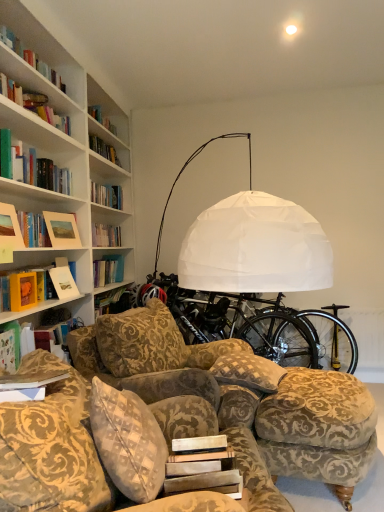
Locate an element on the screen. The image size is (384, 512). hardcover book at left, which ranks as the first book in top-to-bottom order is located at coordinates (63, 282).

What do you see at coordinates (150, 294) in the screenshot? I see `black matte bicycle wheel at center` at bounding box center [150, 294].

I want to click on matte green book at left, arranged as the 2th book when viewed from the top, so click(43, 340).

Is point (267, 366) closer or farther from the camera than point (18, 295)?

Point (267, 366) is positioned farther from the camera compared to point (18, 295).

Is patterned fabric pillow at center smaller than matte yellow book at left, acting as the first paperback book starting from the top?

Incorrect, patterned fabric pillow at center is not smaller in size than matte yellow book at left, acting as the first paperback book starting from the top.

From the image's perspective, is patterned fabric pillow at center on matte yellow book at left, the first paperback book when ordered from left to right?

Actually, patterned fabric pillow at center appears below matte yellow book at left, the first paperback book when ordered from left to right, in the image.

Is patterned fabric pillow at center touching matte yellow book at left, the second paperback book when ordered from bottom to top?

No.

Would you say patterned fabric pillow at center is a long distance from velvet-patterned couch at lower center?

Absolutely, patterned fabric pillow at center is distant from velvet-patterned couch at lower center.

Is patterned fabric pillow at center bigger or smaller than velvet-patterned couch at lower center?

In the image, patterned fabric pillow at center appears to be smaller than velvet-patterned couch at lower center.

From a real-world perspective, is matte yellow book at left, positioned as the 1th paperback book in back-to-front order, over matte wooden picture frame at upper left, marked as the 1th picture frame in a front-to-back arrangement?

Incorrect, from a real-world perspective, matte yellow book at left, positioned as the 1th paperback book in back-to-front order, is lower than matte wooden picture frame at upper left, marked as the 1th picture frame in a front-to-back arrangement.

Who is shorter, matte yellow book at left, positioned as the 1th paperback book in back-to-front order, or matte wooden picture frame at upper left, marked as the 2th picture frame in a back-to-front arrangement?

With less height is matte yellow book at left, positioned as the 1th paperback book in back-to-front order.

From the image's perspective, is matte yellow book at left, which is the 2th paperback book from front to back, above matte wooden picture frame at upper left, marked as the 1th picture frame in a front-to-back arrangement?

Actually, matte yellow book at left, which is the 2th paperback book from front to back, appears below matte wooden picture frame at upper left, marked as the 1th picture frame in a front-to-back arrangement, in the image.

Is matte yellow book at left, acting as the first paperback book starting from the top, to the left of matte wooden picture frame at upper left, marked as the 2th picture frame in a back-to-front arrangement, from the viewer's perspective?

No, matte yellow book at left, acting as the first paperback book starting from the top, is not to the left of matte wooden picture frame at upper left, marked as the 2th picture frame in a back-to-front arrangement.

Considering the sizes of patterned fabric pillow at center and matte green book at left, the 1th book when ordered from front to back, in the image, is patterned fabric pillow at center bigger or smaller than matte green book at left, the 1th book when ordered from front to back,?

In the image, patterned fabric pillow at center appears to be smaller than matte green book at left, the 1th book when ordered from front to back.

How far apart are patterned fabric pillow at center and matte green book at left, arranged as the 2th book when viewed from the top?

A distance of 38.19 inches exists between patterned fabric pillow at center and matte green book at left, arranged as the 2th book when viewed from the top.

Is patterned fabric pillow at center at the left side of matte green book at left, arranged as the 2th book when viewed from the top?

In fact, patterned fabric pillow at center is to the right of matte green book at left, arranged as the 2th book when viewed from the top.

Is black matte bicycle wheel at center looking in the opposite direction of hardcover book at left, arranged as the second book when viewed from the front?

No.

Is black matte bicycle wheel at center behind hardcover book at left, which is the first book in back-to-front order?

Yes.

Who is shorter, black matte bicycle wheel at center or hardcover book at left, which ranks as the first book in top-to-bottom order?

black matte bicycle wheel at center is shorter.

Is black matte bicycle wheel at center positioned far away from hardcover book at left, which ranks as the first book in top-to-bottom order?

No, black matte bicycle wheel at center is not far from hardcover book at left, which ranks as the first book in top-to-bottom order.

Which is in front, point (69, 400) or point (152, 288)?

The point (69, 400) is more forward.

What's the angular difference between velvet-patterned couch at lower center and black matte bicycle wheel at center's facing directions?

The angular difference between velvet-patterned couch at lower center and black matte bicycle wheel at center is 107 degrees.

Considering the relative sizes of velvet-patterned couch at lower center and black matte bicycle wheel at center in the image provided, is velvet-patterned couch at lower center taller than black matte bicycle wheel at center?

Correct, velvet-patterned couch at lower center is much taller as black matte bicycle wheel at center.

Is black matte bicycle wheel at center located within velvet-patterned couch at lower center?

No.

Find the location of a particular element. The width and height of the screenshot is (384, 512). the 2nd paperback book positioned above the black metallic bicycle wheel at lower right (from a real-world perspective) is located at coordinates (23, 291).

Is matte yellow book at left, which appears as the second paperback book when viewed from the right, facing away from black metallic bicycle wheel at lower right?

No.

This screenshot has height=512, width=384. In order to click on pillow below the matte yellow book at left, the first paperback book when ordered from left to right (from the image's perspective) in this screenshot , I will do `click(248, 371)`.

Locate an element on the screen. pillow above the velvet-patterned couch at lower center (from a real-world perspective) is located at coordinates (248, 371).

Which object lies further to the anchor point matte green book at left, arranged as the 2th book when viewed from the top, black matte bicycle at center or velvet-patterned couch at lower center?

black matte bicycle at center is further to matte green book at left, arranged as the 2th book when viewed from the top.

When comparing their distances from matte wooden picture frame at upper left, marked as the 2th picture frame in a back-to-front arrangement, does patterned fabric pillow at center or black matte bicycle wheel at center seem closer?

black matte bicycle wheel at center is closer to matte wooden picture frame at upper left, marked as the 2th picture frame in a back-to-front arrangement.

Considering their positions, is matte yellow book at left, the first paperback book when ordered from left to right, positioned further to velvet-patterned couch at lower center than matte gold picture frame at upper left, the second picture frame positioned from the front?

Among the two, matte gold picture frame at upper left, the second picture frame positioned from the front, is located further to velvet-patterned couch at lower center.

Based on their spatial positions, is matte wooden picture frame at upper left, marked as the 2th picture frame in a back-to-front arrangement, or gold-patterned fabric ottoman at lower right closer to white paper at center, the 2th paperback book from the top?

gold-patterned fabric ottoman at lower right.

Looking at the image, which one is located further to white paper at center, the 2th paperback book from the top, patterned fabric pillow at center or matte yellow book at left, the second paperback book when ordered from bottom to top?

Based on the image, matte yellow book at left, the second paperback book when ordered from bottom to top, appears to be further to white paper at center, the 2th paperback book from the top.

Based on their spatial positions, is matte gold picture frame at upper left, the second picture frame positioned from the front, or black metallic bicycle wheel at lower right closer to white paper at center, which is the first paperback book in front-to-back order?

Based on the image, matte gold picture frame at upper left, the second picture frame positioned from the front, appears to be nearer to white paper at center, which is the first paperback book in front-to-back order.

Looking at the image, which one is located further to velvet-patterned couch at lower center, matte gold picture frame at upper left, the second picture frame positioned from the front, or patterned fabric pillow at center?

matte gold picture frame at upper left, the second picture frame positioned from the front, is further to velvet-patterned couch at lower center.

Looking at the image, which one is located further to hardcover book at left, which is the first book in back-to-front order, black metallic bicycle wheel at lower right or matte wooden picture frame at upper left, marked as the 2th picture frame in a back-to-front arrangement?

The object further to hardcover book at left, which is the first book in back-to-front order, is black metallic bicycle wheel at lower right.

Image resolution: width=384 pixels, height=512 pixels. Identify the location of pillow between velvet-patterned couch at lower center and black matte bicycle wheel at center along the z-axis. (248, 371).

Locate an element on the screen. The height and width of the screenshot is (512, 384). pillow between matte gold picture frame at upper left, the second picture frame positioned from the front, and black metallic bicycle wheel at lower right is located at coordinates (248, 371).

The image size is (384, 512). In order to click on book between white paper at center, the 2th paperback book viewed from the back, and matte gold picture frame at upper left, the second picture frame positioned from the front, in the front-back direction in this screenshot , I will do `click(43, 340)`.

I want to click on swivel chair located between white paper at center, acting as the first paperback book starting from the bottom, and patterned fabric pillow at center in the depth direction, so click(318, 429).